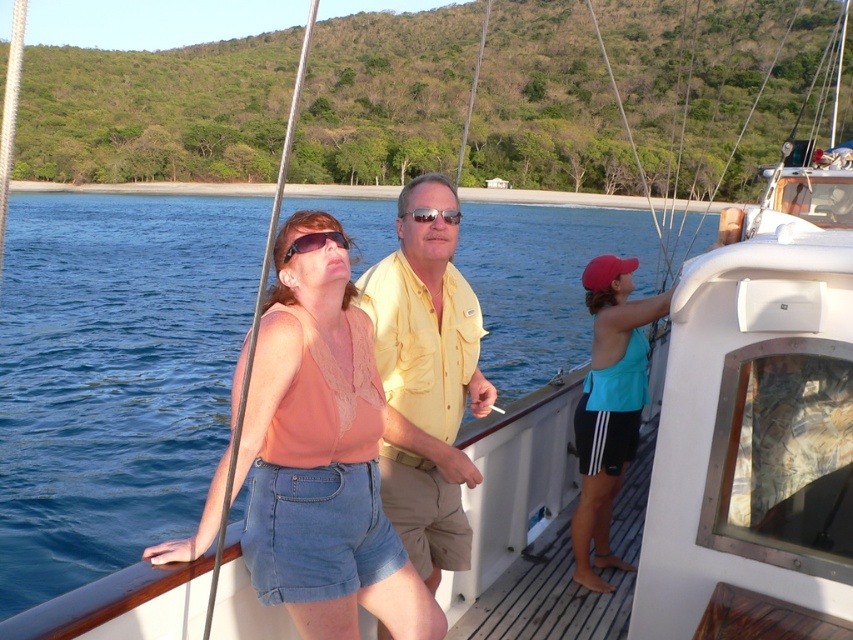
You are a photographer on the sailboat and want to capture both the yellow cotton shirt at center and the shiny gold sunglasses at center in a single photo. Since you want both items to appear clearly, which object should you focus on first to ensure sharpness?

You should focus on the yellow cotton shirt at center first because it is larger in size than the shiny gold sunglasses at center, making it easier to capture details clearly.

You are a photographer on the boat and want to capture both the matte peach tank top at center and the matte black sunglasses at center in the same frame. Which object should you focus on first to ensure both are in the shot?

The matte peach tank top at center is positioned on the left side of matte black sunglasses at center, so you should focus on the matte black sunglasses at center first to ensure both are included in the frame.

You are a photographer on the deck of the sailboat and want to take a photo of both the matte peach tank top at center and the teal fabric tank top at right. However, you notice that one is blocking the other. Which tank top is blocking the other?

The matte peach tank top at center is in front of the teal fabric tank top at right, so it is blocking the teal fabric tank top at right.